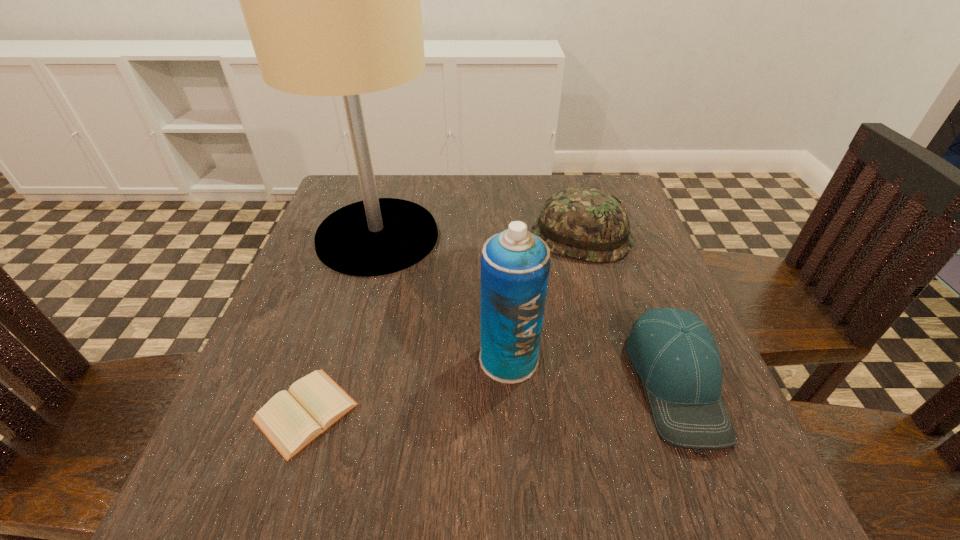
The height and width of the screenshot is (540, 960). Find the location of `vacant space located 0.110m on the right of the diary`. vacant space located 0.110m on the right of the diary is located at coordinates (427, 411).

The width and height of the screenshot is (960, 540). What are the coordinates of `table lamp that is at the far edge` in the screenshot? It's located at (331, 0).

Locate an element on the screen. Image resolution: width=960 pixels, height=540 pixels. headwear at the far edge is located at coordinates (584, 223).

Where is `object at the near edge`? object at the near edge is located at coordinates (290, 421).

I want to click on table lamp that is at the left edge, so click(331, 0).

The height and width of the screenshot is (540, 960). I want to click on diary at the left edge, so click(x=290, y=421).

Where is `headwear located at the right edge`? This screenshot has width=960, height=540. headwear located at the right edge is located at coordinates (584, 223).

I want to click on baseball cap situated at the right edge, so click(674, 353).

The image size is (960, 540). Identify the location of object that is at the far left corner. (331, 0).

Where is `object located at the near left corner`? The image size is (960, 540). object located at the near left corner is located at coordinates (290, 421).